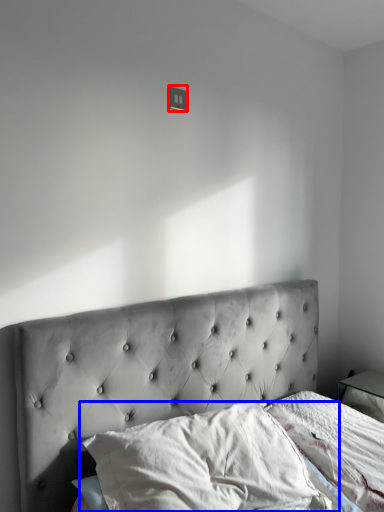
Question: Among these objects, which one is farthest to the camera, electric outlet (highlighted by a red box) or pillow (highlighted by a blue box)?

Choices:
 (A) electric outlet
 (B) pillow

Answer: (A)